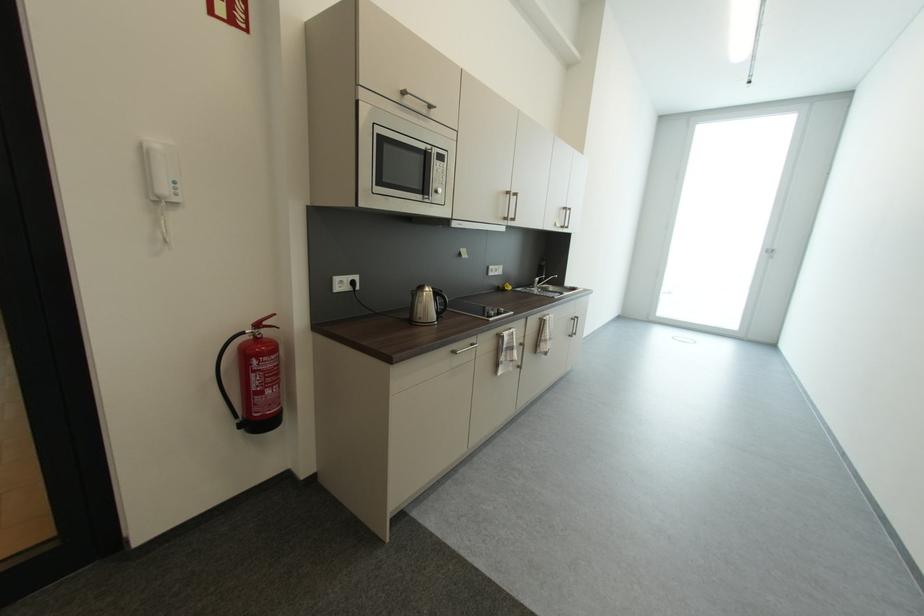
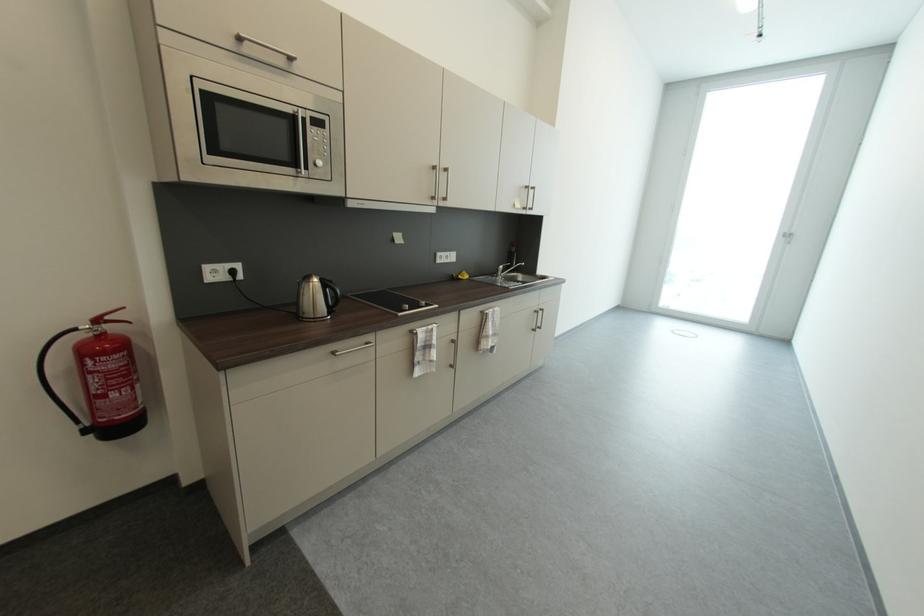
Question: The camera is either moving clockwise (left) or counter-clockwise (right) around the object. The first image is from the beginning of the video and the second image is from the end. Is the camera moving left or right when shooting the video?

Choices:
 (A) Left
 (B) Right

Answer: (B)